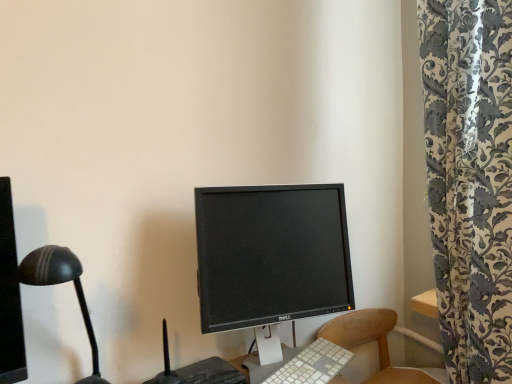
Question: Does point (274, 375) appear closer or farther from the camera than point (259, 236)?

Choices:
 (A) closer
 (B) farther

Answer: (B)

Question: In terms of height, does white plastic keyboard at center look taller or shorter compared to black glossy monitor at center?

Choices:
 (A) short
 (B) tall

Answer: (A)

Question: Based on their relative distances, which object is nearer to the wooden chair at lower right?

Choices:
 (A) black matte desk lamp at left
 (B) black glossy monitor at center
 (C) white plastic keyboard at center

Answer: (C)

Question: Estimate the real-world distances between objects in this image. Which object is farther from the white plastic keyboard at center?

Choices:
 (A) wooden chair at lower right
 (B) black matte desk lamp at left
 (C) black glossy monitor at center

Answer: (B)